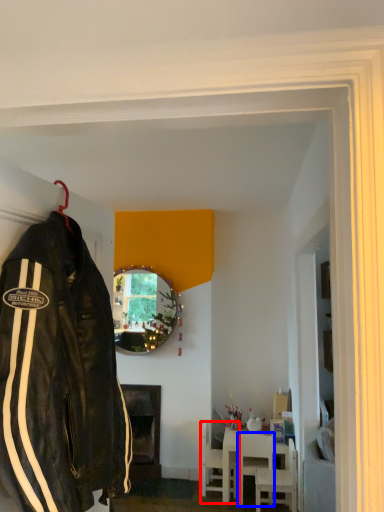
Question: Which object is closer to the camera taking this photo, chair (highlighted by a red box) or chair (highlighted by a blue box)?

Choices:
 (A) chair
 (B) chair

Answer: (B)